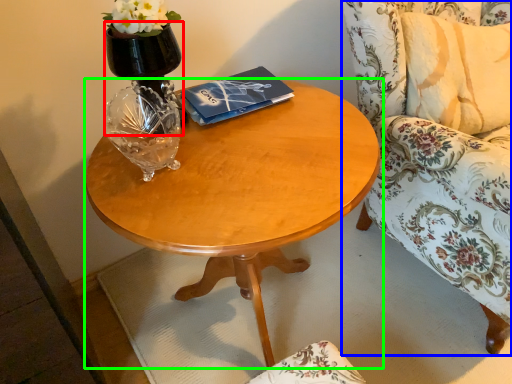
Question: Estimate the real-world distances between objects in this image. Which object is farther from vase (highlighted by a red box), chair (highlighted by a blue box) or coffee table (highlighted by a green box)?

Choices:
 (A) chair
 (B) coffee table

Answer: (A)